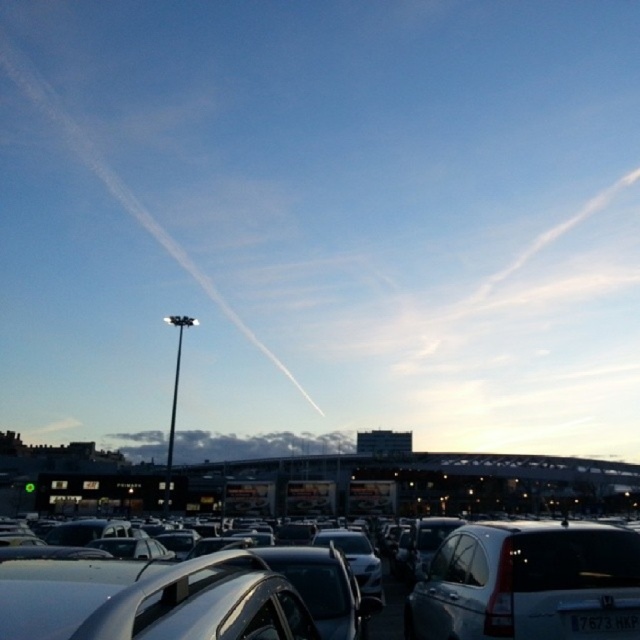
You are driving a delivery van that is 5 meters long and need to maneuver between the silver metallic car at center and the white matte sedan at lower right. Is there enough space for your van to pass through the gap between them?

The distance between the silver metallic car at center and the white matte sedan at lower right is 4.69 meters. Since your delivery van is 5 meters long, it is slightly too long to fit through the gap. You should look for another path or rearrange the vehicles to create more space.

You are a delivery driver who needs to park your truck in the parking lot. You see the white matte sedan at lower right and the white plastic license plate at center. Which vehicle has a wider body?

The white matte sedan at lower right has a wider body than the white plastic license plate at center because the sedan is wider than the license plate.